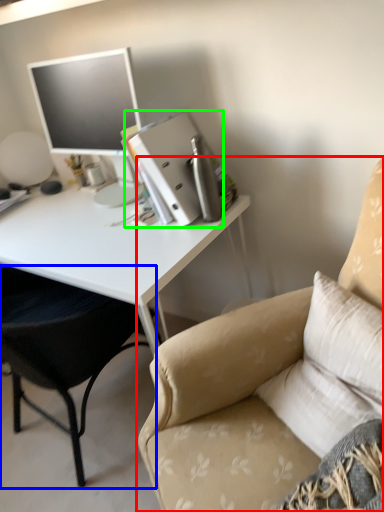
Question: Which object is positioned closest to chair (highlighted by a red box)? Select from chair (highlighted by a blue box) and binder (highlighted by a green box).

Choices:
 (A) chair
 (B) binder

Answer: (A)